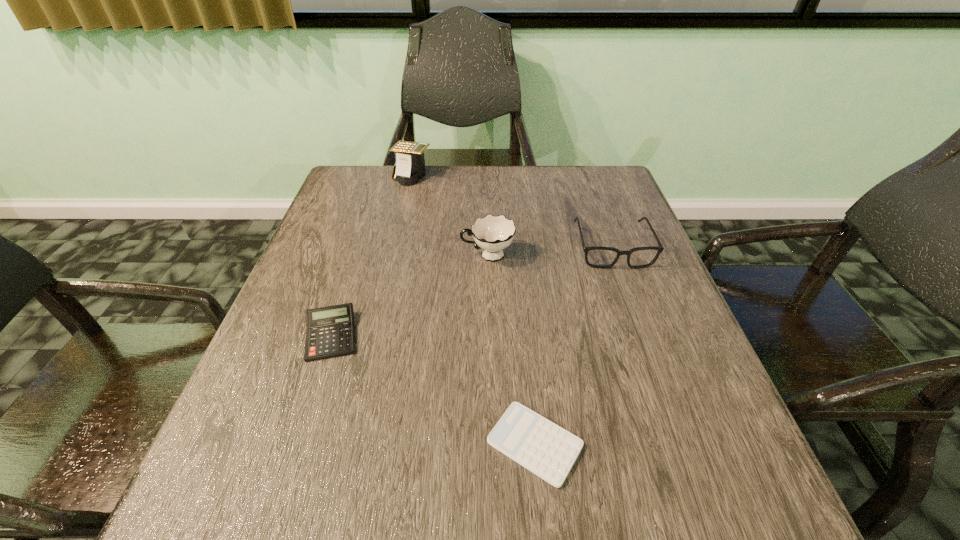
The width and height of the screenshot is (960, 540). In order to click on free spot located 0.060m on the side of the cup with the handle in this screenshot , I will do `click(435, 255)`.

Where is `blank area located 0.220m on the side of the cup with the handle`? The width and height of the screenshot is (960, 540). blank area located 0.220m on the side of the cup with the handle is located at coordinates (369, 255).

Image resolution: width=960 pixels, height=540 pixels. Find the location of `free space located 0.230m on the side of the cup with the handle`. free space located 0.230m on the side of the cup with the handle is located at coordinates (364, 255).

This screenshot has width=960, height=540. I want to click on blank space located on the front-facing side of the spectacles, so click(x=658, y=375).

Image resolution: width=960 pixels, height=540 pixels. What are the coordinates of `free spot located on the front of the second tallest calculator` in the screenshot? It's located at (267, 533).

The width and height of the screenshot is (960, 540). What are the coordinates of `vacant space situated 0.230m on the left of the shortest calculator` in the screenshot? It's located at (343, 443).

Where is `object that is at the far edge`? The height and width of the screenshot is (540, 960). object that is at the far edge is located at coordinates click(x=410, y=163).

I want to click on object present at the near edge, so click(x=547, y=450).

The height and width of the screenshot is (540, 960). In order to click on object situated at the right edge in this screenshot , I will do `click(598, 257)`.

You are a GUI agent. You are given a task and a screenshot of the screen. Output one action in this format:
    pyautogui.click(x=<x>, y=<y>)
    Task: Click on the object at the far left corner
    The image size is (960, 540).
    Given the screenshot: What is the action you would take?
    pyautogui.click(x=410, y=163)